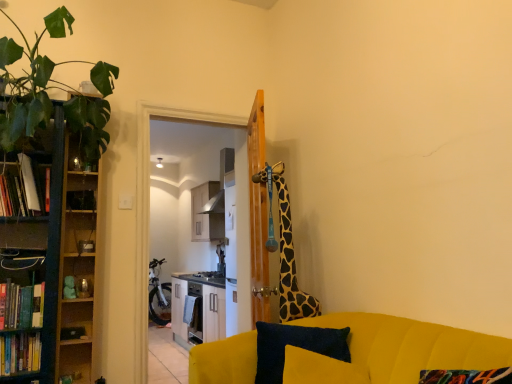
What do you see at coordinates (295, 346) in the screenshot? I see `velvet dark blue pillow at lower center` at bounding box center [295, 346].

Describe the element at coordinates (207, 212) in the screenshot. This screenshot has height=384, width=512. I see `white glossy cabinet at center` at that location.

This screenshot has width=512, height=384. What do you see at coordinates (259, 214) in the screenshot?
I see `wooden door at upper center` at bounding box center [259, 214].

Where is `wooden door at upper center`? The image size is (512, 384). wooden door at upper center is located at coordinates (259, 214).

Describe the element at coordinates (47, 262) in the screenshot. I see `green matte bookcase at left` at that location.

The image size is (512, 384). I want to click on green matte bookcase at left, so click(47, 262).

You are a GUI agent. You are given a task and a screenshot of the screen. Output one action in this format:
    pyautogui.click(x=<x>, y=<y>)
    Task: Click on the green leafy plant at left
    
    Given the screenshot: What is the action you would take?
    pyautogui.click(x=39, y=81)

The width and height of the screenshot is (512, 384). In order to click on spotted fabric giraffe at upper right in this screenshot , I will do `click(285, 250)`.

Is velvet yellow couch at lower right a part of spotted fabric giraffe at upper right?

That's incorrect, velvet yellow couch at lower right is not inside spotted fabric giraffe at upper right.

From a real-world perspective, which is physically below, spotted fabric giraffe at upper right or velvet yellow couch at lower right?

velvet yellow couch at lower right.

From the image's perspective, between spotted fabric giraffe at upper right and velvet yellow couch at lower right, which one is located above?

spotted fabric giraffe at upper right, from the image's perspective.

Does point (304, 315) lie behind point (251, 333)?

Yes, point (304, 315) is farther from viewer.

In terms of height, does wooden door at upper center look taller or shorter compared to white paper book at left, acting as the 1th book starting from the top?

Clearly, wooden door at upper center is taller compared to white paper book at left, acting as the 1th book starting from the top.

Which object is further away from the camera, wooden door at upper center or white paper book at left, marked as the 3th book in a bottom-to-top arrangement?

Positioned behind is wooden door at upper center.

Looking at this image, is wooden door at upper center oriented away from white paper book at left, marked as the 3th book in a bottom-to-top arrangement?

That's not correct — wooden door at upper center is not looking away from white paper book at left, marked as the 3th book in a bottom-to-top arrangement.

Is wooden door at upper center thinner than white paper book at left, marked as the 3th book in a bottom-to-top arrangement?

Correct, the width of wooden door at upper center is less than that of white paper book at left, marked as the 3th book in a bottom-to-top arrangement.

Is green matte bookcase at left located within white paper book at left, acting as the 1th book starting from the top?

No, green matte bookcase at left is not a part of white paper book at left, acting as the 1th book starting from the top.

Image resolution: width=512 pixels, height=384 pixels. I want to click on book that is above the green matte bookcase at left (from a real-world perspective), so [20, 190].

Is white paper book at left, acting as the 1th book starting from the top, oriented away from green matte bookcase at left?

Correct, white paper book at left, acting as the 1th book starting from the top, is looking away from green matte bookcase at left.

Considering the sizes of objects white paper book at left, acting as the 1th book starting from the top, and green matte bookcase at left in the image provided, who is thinner, white paper book at left, acting as the 1th book starting from the top, or green matte bookcase at left?

white paper book at left, acting as the 1th book starting from the top.

Is velvet dark blue pillow at lower center positioned beyond the bounds of hardcover book at left, which is counted as the 3th book, starting from the top?

Indeed, velvet dark blue pillow at lower center is completely outside hardcover book at left, which is counted as the 3th book, starting from the top.

From a real-world perspective, who is located higher, velvet dark blue pillow at lower center or hardcover book at left, which is counted as the 3th book, starting from the top?

velvet dark blue pillow at lower center, from a real-world perspective.

Does velvet dark blue pillow at lower center appear on the right side of hardcover book at left, which is counted as the 3th book, starting from the top?

Correct, you'll find velvet dark blue pillow at lower center to the right of hardcover book at left, which is counted as the 3th book, starting from the top.

Which point is more forward, [71,260] or [285,229]?

The point [285,229] is in front.

Is wooden shelf at left bigger or smaller than spotted fabric giraffe at upper right?

Clearly, wooden shelf at left is larger in size than spotted fabric giraffe at upper right.

Is wooden shelf at left with spotted fabric giraffe at upper right?

No, wooden shelf at left is not touching spotted fabric giraffe at upper right.

Between green matte bookcase at left and hardcover book at left, the second book positioned from the bottom, which one has more height?

green matte bookcase at left.

Considering the relative positions of green matte bookcase at left and hardcover book at left, the second book positioned from the bottom, in the image provided, is green matte bookcase at left to the right of hardcover book at left, the second book positioned from the bottom, from the viewer's perspective?

Yes.

Between green matte bookcase at left and hardcover book at left, the 2th book positioned from the top, which one has larger width?

green matte bookcase at left is wider.

Considering the points (313, 329) and (40, 98), which point is behind, point (313, 329) or point (40, 98)?

The point (40, 98) is farther from the camera.

Which is more to the right, velvet dark blue pillow at lower center or green leafy plant at left?

velvet dark blue pillow at lower center is more to the right.

Measure the distance between velvet dark blue pillow at lower center and green leafy plant at left.

velvet dark blue pillow at lower center and green leafy plant at left are 1.58 meters apart from each other.

Do you think velvet dark blue pillow at lower center is within green leafy plant at left, or outside of it?

velvet dark blue pillow at lower center cannot be found inside green leafy plant at left.

The image size is (512, 384). In order to click on giraffe located behind the velvet yellow couch at lower right in this screenshot , I will do `click(285, 250)`.

What are the coordinates of `door below the white paper book at left, acting as the 1th book starting from the top (from a real-world perspective)` in the screenshot? It's located at (259, 214).

Estimate the real-world distances between objects in this image. Which object is further from spotted fabric giraffe at upper right, hardcover book at left, the second book positioned from the bottom, or hardcover book at left, which is counted as the 3th book, starting from the top?

The object further to spotted fabric giraffe at upper right is hardcover book at left, which is counted as the 3th book, starting from the top.

From the image, which object appears to be nearer to white glossy cabinet at center, velvet yellow couch at lower right or hardcover book at left, the 2th book positioned from the top?

hardcover book at left, the 2th book positioned from the top, lies closer to white glossy cabinet at center than the other object.

Considering their positions, is wooden door at upper center positioned closer to hardcover book at left, acting as the 1th book starting from the bottom, than hardcover book at left, the second book positioned from the bottom?

hardcover book at left, the second book positioned from the bottom, lies closer to hardcover book at left, acting as the 1th book starting from the bottom, than the other object.

Considering their positions, is green leafy plant at left positioned closer to velvet yellow couch at lower right than white glossy cabinet at center?

green leafy plant at left lies closer to velvet yellow couch at lower right than the other object.

Estimate the real-world distances between objects in this image. Which object is closer to wooden shelf at left, velvet yellow couch at lower right or velvet dark blue pillow at lower center?

Among the two, velvet dark blue pillow at lower center is located nearer to wooden shelf at left.

Considering their positions, is green leafy plant at left positioned further to wooden door at upper center than hardcover book at left, the 2th book positioned from the top?

The object further to wooden door at upper center is hardcover book at left, the 2th book positioned from the top.

Which object lies further to the anchor point hardcover book at left, which is counted as the 3th book, starting from the top, white glossy cabinet at center or white paper book at left, marked as the 3th book in a bottom-to-top arrangement?

white glossy cabinet at center.

Based on their spatial positions, is hardcover book at left, acting as the 1th book starting from the bottom, or white glossy cabinet at center closer to wooden door at upper center?

hardcover book at left, acting as the 1th book starting from the bottom.

Where is `plant between velvet dark blue pillow at lower center and white glossy cabinet at center along the z-axis`? plant between velvet dark blue pillow at lower center and white glossy cabinet at center along the z-axis is located at coordinates (39, 81).

Where is `giraffe located between green matte bookcase at left and white glossy cabinet at center in the depth direction`? giraffe located between green matte bookcase at left and white glossy cabinet at center in the depth direction is located at coordinates (285, 250).

Image resolution: width=512 pixels, height=384 pixels. In order to click on door between spotted fabric giraffe at upper right and white glossy cabinet at center along the z-axis in this screenshot , I will do `click(259, 214)`.

Where is `bookcase between velvet dark blue pillow at lower center and white glossy cabinet at center along the z-axis`? The image size is (512, 384). bookcase between velvet dark blue pillow at lower center and white glossy cabinet at center along the z-axis is located at coordinates (47, 262).